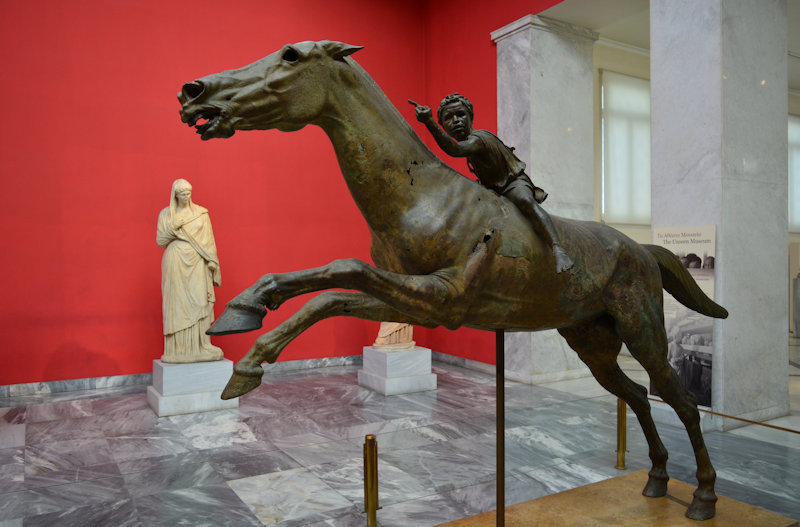
At what (x,y) coordinates should I click in order to perform the action: click on column. Please return your answer as a coordinate pair (x, y). The image size is (800, 527). Looking at the image, I should click on (720, 153), (554, 133).